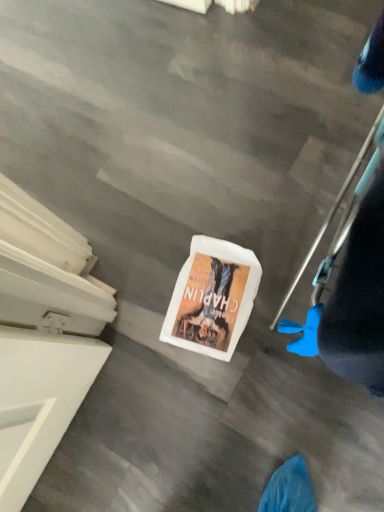
The height and width of the screenshot is (512, 384). What are the coordinates of `vacant area that is situated to the right of white matte book at center` in the screenshot? It's located at (273, 238).